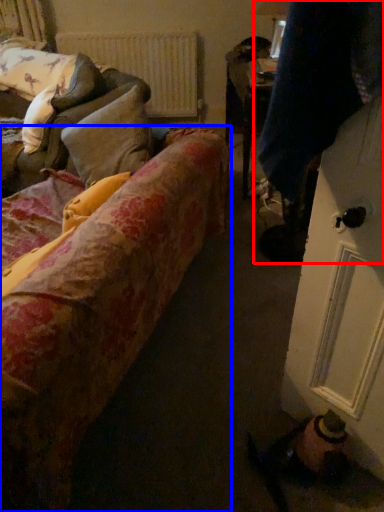
Question: Among these objects, which one is farthest to the camera, couple (highlighted by a red box) or studio couch (highlighted by a blue box)?

Choices:
 (A) couple
 (B) studio couch

Answer: (A)